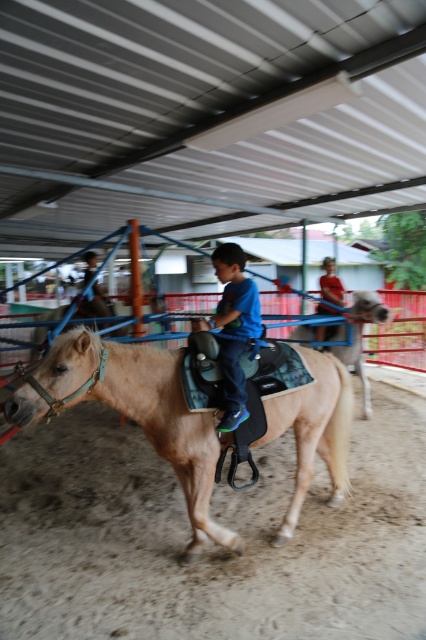
From the picture: You are a photographer taking a photo of the blue matte shirt at center and the light brown leather horse at center. Which object should you focus on first if you want to capture both in sharp focus?

The blue matte shirt at center is above the light brown leather horse at center, so you should focus on the light brown leather horse at center first to ensure both are in sharp focus.

You are a photographer setting up a camera to capture the scene. The camera has a fixed width frame. If you want to include both the blue matte shirt at center and the light brown leather horse at center in the frame, which object should you position closer to the camera to ensure both fit within the frame?

Since the blue matte shirt at center is narrower than the light brown leather horse at center, you should position the blue matte shirt at center closer to the camera. This way, the shirt will appear larger in the frame, balancing its size with the horse to fit within the fixed width.

You are a photographer standing at the edge of the fenced area. You want to take a photo of the blue matte shirt at center and the light brown leather horse at center. Which object should you focus on first if you want to capture both in the frame without moving the camera?

The blue matte shirt at center is not as tall as the light brown leather horse at center, so you should focus on the light brown leather horse at center first to ensure it fits in the frame.